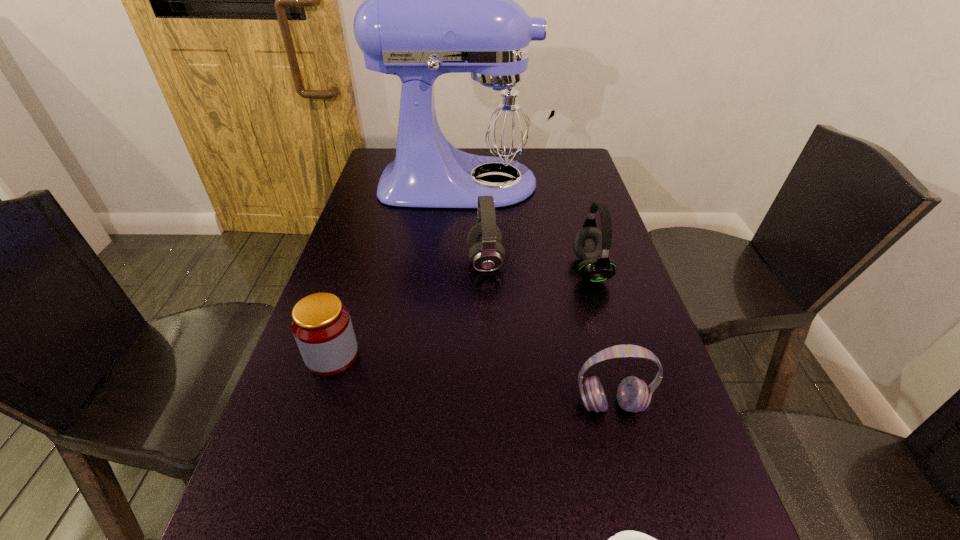
Where is `vacant area located on the headband and ear cups of the nearest headset`? vacant area located on the headband and ear cups of the nearest headset is located at coordinates (631, 484).

Image resolution: width=960 pixels, height=540 pixels. I want to click on free spot located 0.290m on the front of the fourth farthest object, so click(276, 530).

At what (x,y) coordinates should I click in order to perform the action: click on object that is at the far edge. Please return your answer as a coordinate pair (x, y). This screenshot has width=960, height=540. Looking at the image, I should click on (438, 0).

Locate an element on the screen. Image resolution: width=960 pixels, height=540 pixels. mixer that is at the left edge is located at coordinates (438, 0).

The width and height of the screenshot is (960, 540). I want to click on jar that is at the left edge, so click(x=321, y=325).

Where is `mixer located at the right edge`? The width and height of the screenshot is (960, 540). mixer located at the right edge is located at coordinates (438, 0).

The image size is (960, 540). Identify the location of object at the far left corner. (438, 0).

The width and height of the screenshot is (960, 540). Find the location of `object that is at the far right corner`. object that is at the far right corner is located at coordinates (438, 0).

Identify the location of vacant area at the left edge of the desktop. (351, 242).

You are a GUI agent. You are given a task and a screenshot of the screen. Output one action in this format:
    pyautogui.click(x=<x>, y=<y>)
    Task: Click on the vacant area at the right edge of the desktop
    This screenshot has width=960, height=540.
    Given the screenshot: What is the action you would take?
    pyautogui.click(x=657, y=341)